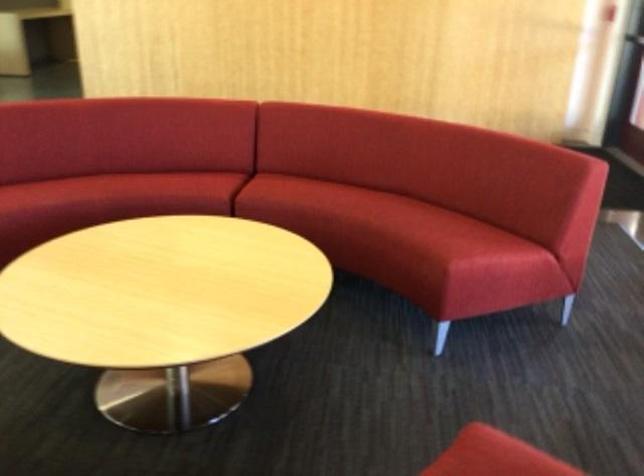
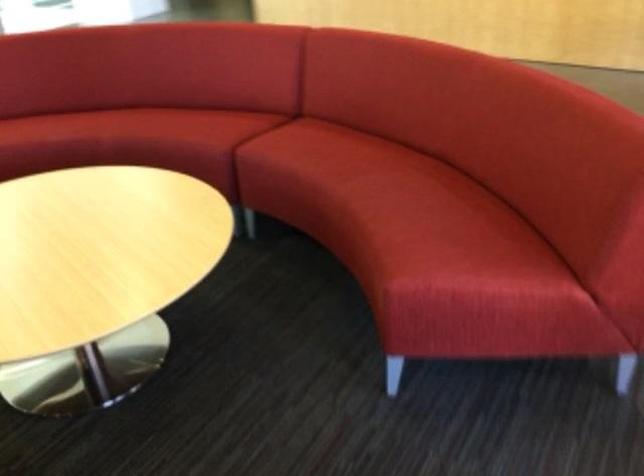
Where in the second image is the point corresponding to (x=375, y=211) from the first image?

(370, 186)